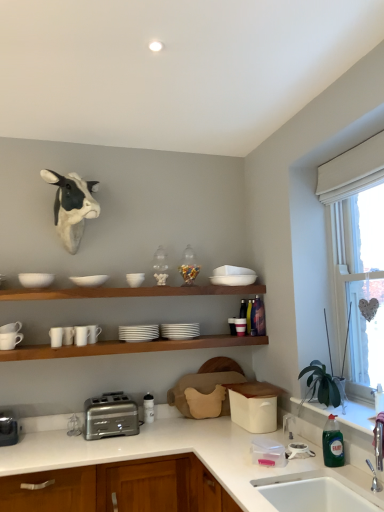
Image resolution: width=384 pixels, height=512 pixels. Identify the location of free space to the left of white matte mug at upper left, the 2th tableware positioned from the left. pos(36,345).